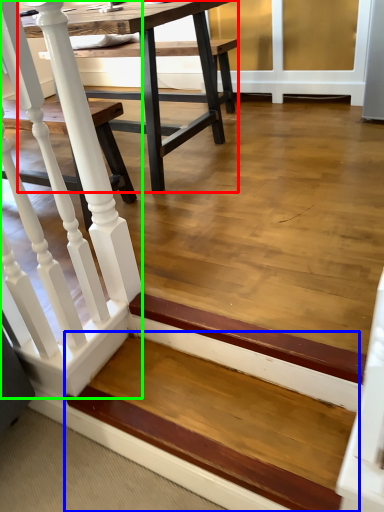
Question: Which is nearer to the table (highlighted by a red box)? stairwell (highlighted by a blue box) or rail (highlighted by a green box).

Choices:
 (A) stairwell
 (B) rail

Answer: (B)